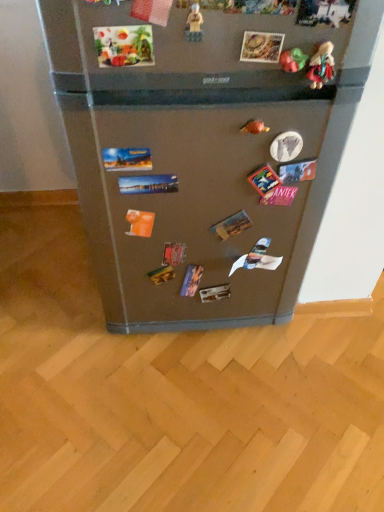
Question: Is matte plastic toy at upper right, which ranks as the 3th toy in front-to-back order, placed right next to translucent plastic toy at upper center, arranged as the 1th toy when viewed from the left?

Choices:
 (A) yes
 (B) no

Answer: (B)

Question: Is translucent plastic toy at upper center, placed as the fourth toy when sorted from right to left, inside matte plastic toy at upper right, which ranks as the 3th toy in front-to-back order?

Choices:
 (A) no
 (B) yes

Answer: (A)

Question: From a real-world perspective, is matte plastic toy at upper right, which ranks as the 3th toy in front-to-back order, beneath translucent plastic toy at upper center, placed as the fourth toy when sorted from right to left?

Choices:
 (A) yes
 (B) no

Answer: (A)

Question: From the image's perspective, is matte plastic toy at upper right, the 3th toy in the left-to-right sequence, located above translucent plastic toy at upper center, placed as the fourth toy when sorted from right to left?

Choices:
 (A) no
 (B) yes

Answer: (A)

Question: Would you consider matte plastic toy at upper right, the 3th toy in the left-to-right sequence, to be distant from translucent plastic toy at upper center, arranged as the 4th toy when viewed from the back?

Choices:
 (A) no
 (B) yes

Answer: (A)

Question: Is the depth of matte plastic toy at upper right, placed as the second toy when sorted from back to front, greater than that of translucent plastic toy at upper center, placed as the fourth toy when sorted from right to left?

Choices:
 (A) no
 (B) yes

Answer: (B)

Question: Can you confirm if matte plastic toy at upper right, the 3th toy in the left-to-right sequence, is thinner than satin silver fridge at center?

Choices:
 (A) yes
 (B) no

Answer: (B)

Question: Is matte plastic toy at upper right, which ranks as the 3th toy in front-to-back order, positioned far away from satin silver fridge at center?

Choices:
 (A) no
 (B) yes

Answer: (A)

Question: Is the position of matte plastic toy at upper right, which ranks as the 3th toy in front-to-back order, less distant than that of satin silver fridge at center?

Choices:
 (A) no
 (B) yes

Answer: (A)

Question: Can we say matte plastic toy at upper right, arranged as the second toy when viewed from the right, lies outside satin silver fridge at center?

Choices:
 (A) yes
 (B) no

Answer: (B)

Question: Is matte plastic toy at upper right, placed as the second toy when sorted from back to front, shorter than satin silver fridge at center?

Choices:
 (A) no
 (B) yes

Answer: (B)

Question: From a real-world perspective, does matte plastic toy at upper right, arranged as the second toy when viewed from the right, stand above satin silver fridge at center?

Choices:
 (A) no
 (B) yes

Answer: (B)

Question: Does matte plastic toy at upper right, which ranks as the 3th toy in front-to-back order, have a smaller size compared to rubber duck at upper right, marked as the 1th toy in a back-to-front arrangement?

Choices:
 (A) yes
 (B) no

Answer: (A)